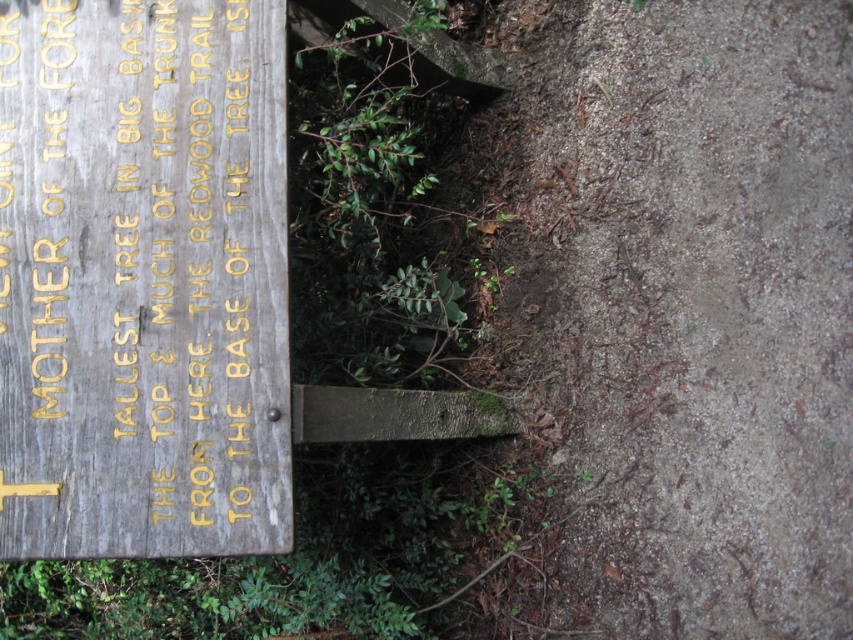
Describe the element at coordinates (686, 307) in the screenshot. Image resolution: width=853 pixels, height=640 pixels. I see `brown dirt trail at lower right` at that location.

Does point (708, 212) lie behind point (363, 376)?

Yes, it is behind point (363, 376).

Between point (601, 307) and point (341, 304), which one is positioned in front?

Point (341, 304) is more forward.

The height and width of the screenshot is (640, 853). I want to click on brown dirt trail at lower right, so click(x=686, y=307).

Is wooden sign at center positioned at the back of weathered wood sign at left?

That is True.

Is point (250, 209) positioned behind point (384, 627)?

No, (250, 209) is in front of (384, 627).

Is point (144, 435) positioned after point (80, 625)?

No.

Image resolution: width=853 pixels, height=640 pixels. Find the location of `wooden sign at center`. wooden sign at center is located at coordinates (142, 280).

Is point (846, 118) in front of point (241, 262)?

No, (846, 118) is further to viewer.

Who is more distant from viewer, (682, 467) or (44, 458)?

The point (682, 467) is more distant.

Where is `brown dirt trail at lower right`? The width and height of the screenshot is (853, 640). brown dirt trail at lower right is located at coordinates click(x=686, y=307).